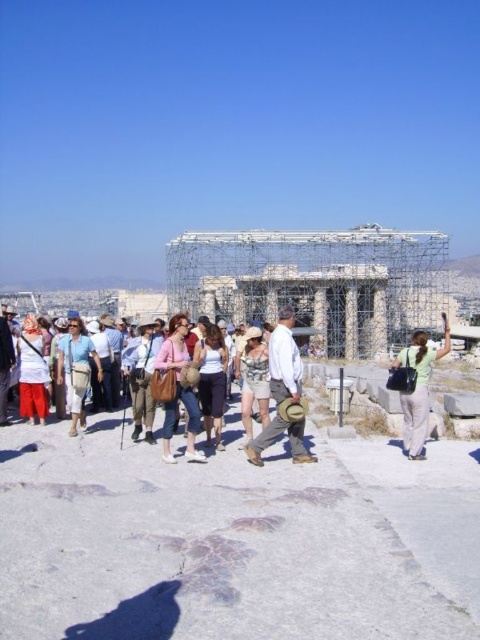
Does green fabric bag at center have a smaller size compared to matte pink shirt at center?

No, green fabric bag at center is not smaller than matte pink shirt at center.

Is point (423, 416) positioned before point (183, 316)?

Yes.

Find the location of a particular element. green fabric bag at center is located at coordinates (418, 387).

This screenshot has width=480, height=640. Find the location of `matte brown hat at center`. matte brown hat at center is located at coordinates (180, 387).

Between matte brown hat at center and printed cotton dress at center, which one appears on the right side from the viewer's perspective?

From the viewer's perspective, printed cotton dress at center appears more on the right side.

From the picture: Measure the distance between matte brown hat at center and camera.

213.37 feet

Locate an element on the screen. matte brown hat at center is located at coordinates (180, 387).

Which of these two, matte pink shirt at center or white matte shorts at center, stands shorter?

white matte shorts at center is shorter.

Is point (180, 378) closer to viewer compared to point (206, 416)?

Yes, it is in front of point (206, 416).

At what (x,y) coordinates should I click in order to perform the action: click on matte pink shirt at center. Please return your answer as a coordinate pair (x, y). Looking at the image, I should click on (178, 388).